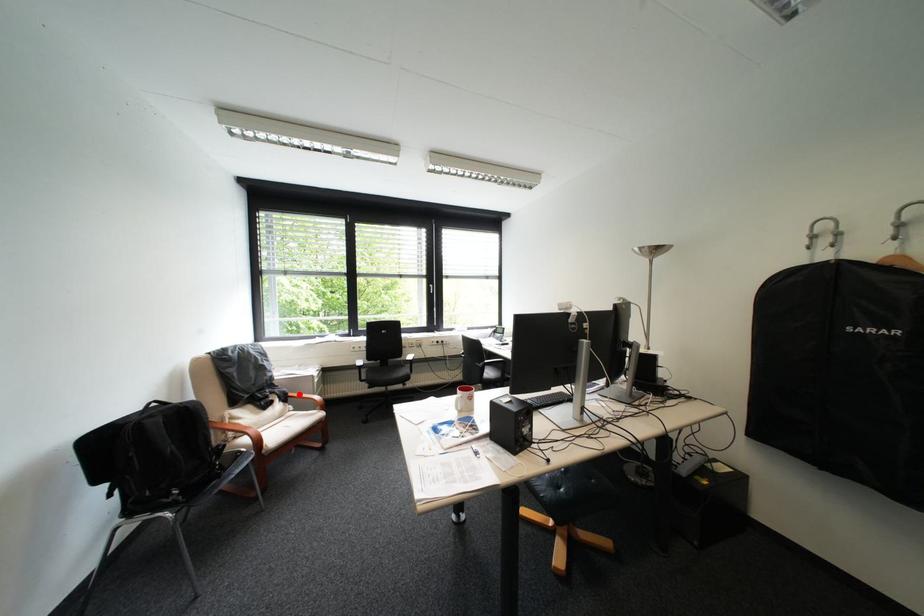
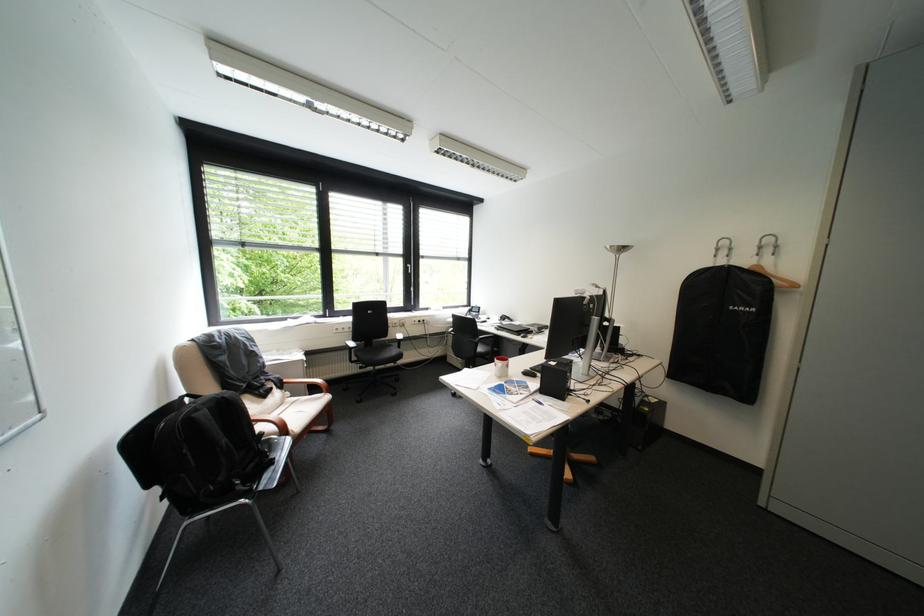
In the second image, find the point that corresponds to the highlighted location in the first image.

(294, 381)